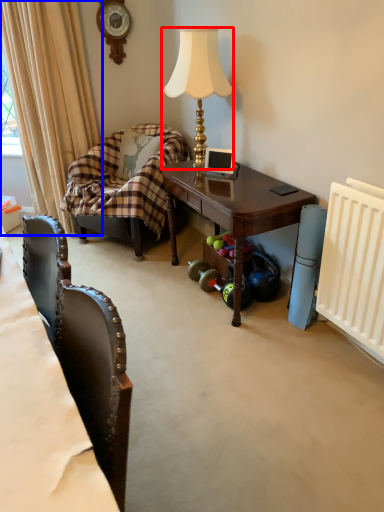
Question: Which object appears closest to the camera in this image, lamp (highlighted by a red box) or curtain (highlighted by a blue box)?

Choices:
 (A) lamp
 (B) curtain

Answer: (A)